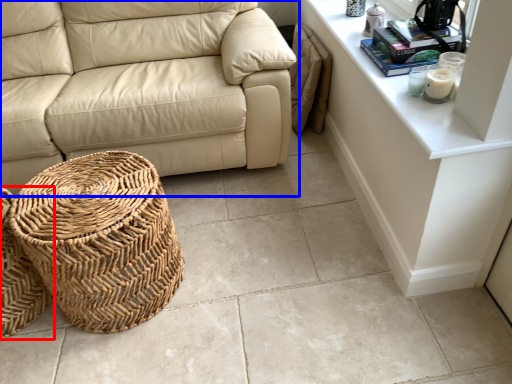
Question: Which object is closer to the camera taking this photo, basket (highlighted by a red box) or studio couch (highlighted by a blue box)?

Choices:
 (A) basket
 (B) studio couch

Answer: (A)